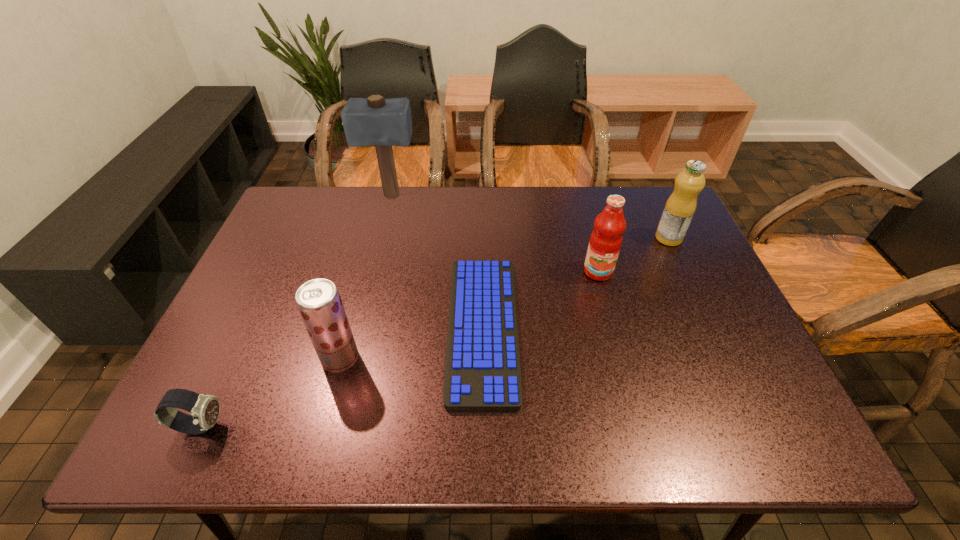
Locate an element on the screen. Image resolution: width=960 pixels, height=540 pixels. mallet is located at coordinates (370, 121).

Locate an element on the screen. the farthest object is located at coordinates (370, 121).

Find the location of `the second farthest object`. the second farthest object is located at coordinates (680, 207).

You are a GUI agent. You are given a task and a screenshot of the screen. Output one action in this format:
    pyautogui.click(x=<x>, y=<y>)
    Task: Click on the farthest fruit juice
    
    Given the screenshot: What is the action you would take?
    pyautogui.click(x=680, y=207)

Where is `the second farthest fruit juice`? the second farthest fruit juice is located at coordinates (605, 242).

At what (x,y) coordinates should I click in order to perform the action: click on the second fruit juice from right to left. Please return your answer as a coordinate pair (x, y). The width and height of the screenshot is (960, 540). Looking at the image, I should click on (605, 242).

You are a GUI agent. You are given a task and a screenshot of the screen. Output one action in this format:
    pyautogui.click(x=<x>, y=<y>)
    Task: Click on the leftmost fruit juice
    This screenshot has width=960, height=540.
    Given the screenshot: What is the action you would take?
    pyautogui.click(x=319, y=303)

Find the location of a particular element. The height and width of the screenshot is (540, 960). watch is located at coordinates (205, 409).

You are a GUI agent. You are given a task and a screenshot of the screen. Output one action in this format:
    pyautogui.click(x=<x>, y=<y>)
    Task: Click on the fifth tallest object
    This screenshot has height=540, width=960.
    Given the screenshot: What is the action you would take?
    pyautogui.click(x=205, y=409)

You are a GUI agent. You are given a task and a screenshot of the screen. Output one action in this format:
    pyautogui.click(x=<x>, y=<y>)
    Task: Click on the shortest object
    This screenshot has height=540, width=960.
    Given the screenshot: What is the action you would take?
    pyautogui.click(x=482, y=370)